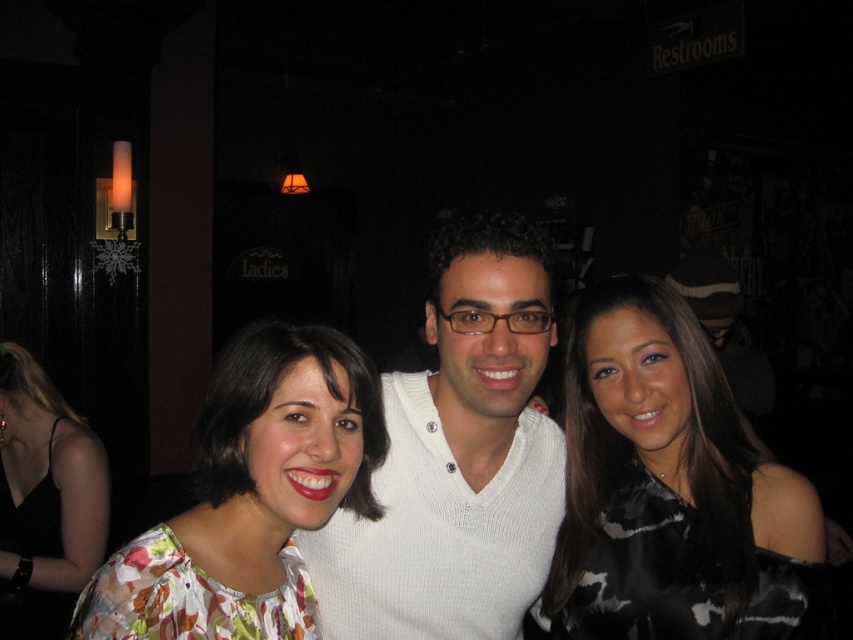
You are a photographer at the event and need to ensure both the white knitted sweater at center and the floral fabric dress at center are fully visible in the photo. Based on their sizes, which one requires more space in the frame?

The floral fabric dress at center requires more space in the frame because it occupies more space than the white knitted sweater at center.

In the image, there are three people standing together. The person on the left is wearing a floral top, and the center person is marked by the point at coordinates (666, 490). Which direction is the center person facing relative to the left person?

The black satin dress at center, represented by the point at coordinates (666, 490), is facing the same direction as the person on the left since they are all posing together towards the camera.

You are standing at the point labeled point (409, 563) and want to reach the exit located at the opposite side of the room. There is a 1.2 meter wide sofa blocking your path. Can you pass through the gap between the sofa and the wall?

The gap between the sofa and the wall is 1.19 meters, which is narrower than the sofa width of 1.2 meters. Therefore, you cannot pass through the gap safely.